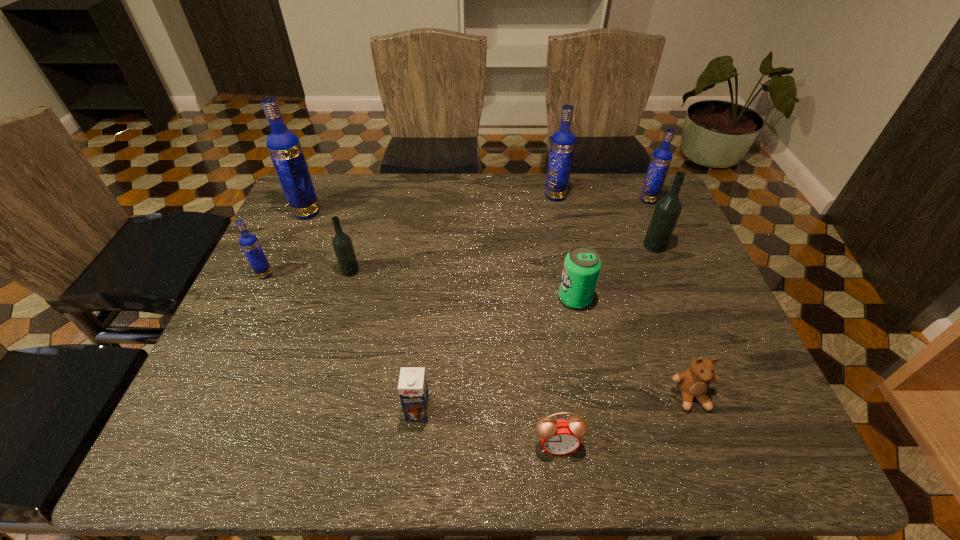
Locate an element on the screen. The width and height of the screenshot is (960, 540). the biggest blue vodka is located at coordinates (284, 147).

Locate an element on the screen. The width and height of the screenshot is (960, 540). the tallest object is located at coordinates (284, 147).

Locate an element on the screen. The height and width of the screenshot is (540, 960). the fourth vodka from left to right is located at coordinates (562, 145).

Image resolution: width=960 pixels, height=540 pixels. Find the location of `the third smallest blue vodka`. the third smallest blue vodka is located at coordinates (562, 145).

The image size is (960, 540). What are the coordinates of `the rightmost blue vodka` in the screenshot? It's located at (661, 159).

Image resolution: width=960 pixels, height=540 pixels. I want to click on the farther black vodka, so click(668, 208).

Find the location of a particular element. This screenshot has width=960, height=540. the third nearest vodka is located at coordinates (668, 208).

This screenshot has width=960, height=540. I want to click on the smallest blue vodka, so click(249, 243).

You are a GUI agent. You are given a task and a screenshot of the screen. Output one action in this format:
    pyautogui.click(x=<x>, y=<y>)
    Task: Click on the eighth object from right to left
    Image resolution: width=960 pixels, height=540 pixels.
    Given the screenshot: What is the action you would take?
    pyautogui.click(x=342, y=243)

The width and height of the screenshot is (960, 540). Find the location of `the left black vodka`. the left black vodka is located at coordinates (342, 243).